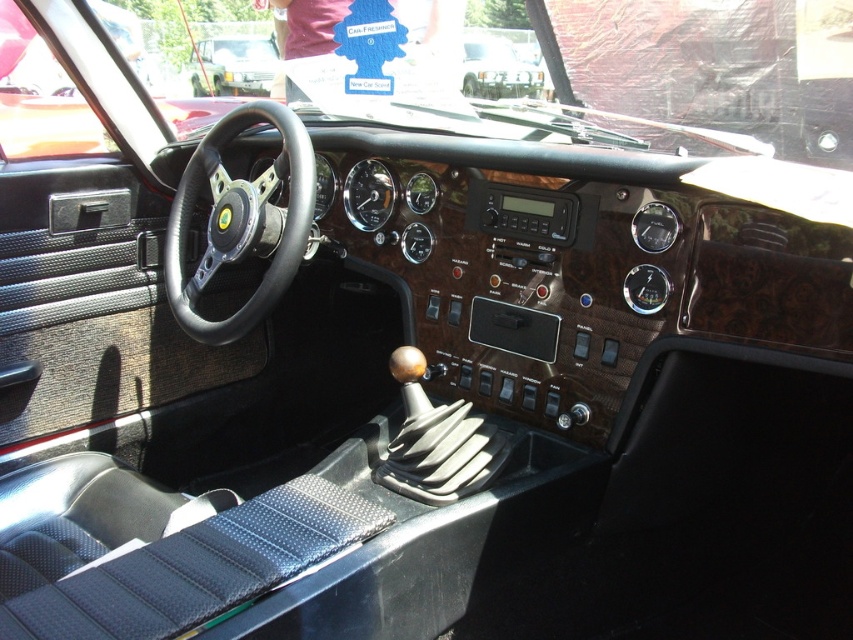
You are a mechanic inspecting the vintage sports car. You notice the matte black steering wheel at center and the metallic silver car at upper center. Which object is bigger in size?

The matte black steering wheel at center is larger in size than the metallic silver car at upper center.

You are a mechanic inspecting the vintage sports car. You need to locate the black leather steering wheel at center. What are the coordinates where you should look?

The black leather steering wheel at center is located at coordinates point (241, 220).

You are sitting in the driver seat of the vintage Lotus sports car. You notice two points marked on the dashboard. The first point is at coordinates point (x=180, y=292) and the second is at point (x=491, y=88). Which point is nearer to your eyes?

Point (x=180, y=292) is closer to the viewer than point (x=491, y=88).